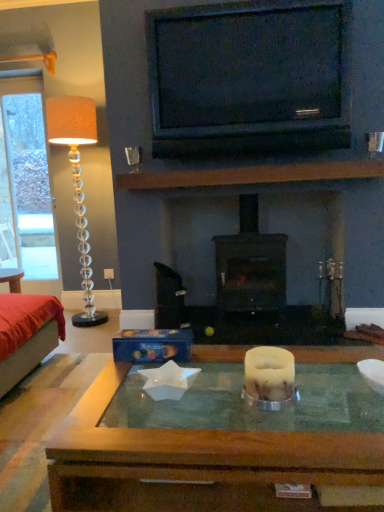
Describe the element at coordinates (27, 334) in the screenshot. The width and height of the screenshot is (384, 512). I see `velvet red bed at left` at that location.

Identify the location of black glossy tv at upper center. [x=249, y=78].

Where is `white plastic power outlet at lower center`? The image size is (384, 512). white plastic power outlet at lower center is located at coordinates (109, 274).

Can you confirm if white wax candle at center is taller than white plastic power outlet at lower center?

Correct, white wax candle at center is much taller as white plastic power outlet at lower center.

Can you confirm if white wax candle at center is wider than white plastic power outlet at lower center?

Yes.

From a real-world perspective, which is physically above, white wax candle at center or white plastic power outlet at lower center?

white wax candle at center, from a real-world perspective.

In the image, is white wax candle at center on the left side or the right side of white plastic power outlet at lower center?

In the image, white wax candle at center appears on the right side of white plastic power outlet at lower center.

Can you confirm if white plastic power outlet at lower center is bigger than white wax candle at center?

Incorrect, white plastic power outlet at lower center is not larger than white wax candle at center.

Can you confirm if white plastic power outlet at lower center is taller than white wax candle at center?

In fact, white plastic power outlet at lower center may be shorter than white wax candle at center.

Is white plastic power outlet at lower center facing towards white wax candle at center?

No, white plastic power outlet at lower center is not aimed at white wax candle at center.

From a real-world perspective, is white plastic power outlet at lower center under white wax candle at center?

Yes, from a real-world perspective, white plastic power outlet at lower center is beneath white wax candle at center.

How far apart are black matte wood burning stove at center and black glossy tv at upper center?

black matte wood burning stove at center and black glossy tv at upper center are 3.38 feet apart.

Is the depth of black matte wood burning stove at center greater than that of black glossy tv at upper center?

Yes, black matte wood burning stove at center is further from the viewer.

From the image's perspective, is black matte wood burning stove at center below black glossy tv at upper center?

Correct, black matte wood burning stove at center appears lower than black glossy tv at upper center in the image.

Is black matte wood burning stove at center far away from black glossy tv at upper center?

Indeed, black matte wood burning stove at center is not near black glossy tv at upper center.

From the image's perspective, who appears lower, white wax candle at center or metallic silver coffee cup at upper left?

white wax candle at center appears lower in the image.

Between white wax candle at center and metallic silver coffee cup at upper left, which one has more height?

Standing taller between the two is metallic silver coffee cup at upper left.

Which is more to the left, white wax candle at center or metallic silver coffee cup at upper left?

Positioned to the left is metallic silver coffee cup at upper left.

Is white wax candle at center beside metallic silver coffee cup at upper left?

No.

Is white wax candle at center at the back of metallic silver coffee cup at upper left?

That's not correct — metallic silver coffee cup at upper left is not looking away from white wax candle at center.

Who is smaller, metallic silver coffee cup at upper left or white wax candle at center?

metallic silver coffee cup at upper left is smaller.

In the image, is metallic silver coffee cup at upper left positioned in front of or behind white wax candle at center?

Visually, metallic silver coffee cup at upper left is located behind white wax candle at center.

From the image's perspective, is metallic silver coffee cup at upper left located above or below white wax candle at center?

Based on their image positions, metallic silver coffee cup at upper left is located above white wax candle at center.

Looking at this image, are velvet red bed at left and translucent glass floor lamp at left located far from each other?

They are positioned close to each other.

Where is `lamp located on the right of velvet red bed at left`? lamp located on the right of velvet red bed at left is located at coordinates (77, 183).

From the image's perspective, is velvet red bed at left on top of translucent glass floor lamp at left?

Incorrect, from the image's perspective, velvet red bed at left is lower than translucent glass floor lamp at left.

Does black matte wood burning stove at center have a lesser height compared to metallic silver coffee cup at upper left?

Incorrect, the height of black matte wood burning stove at center does not fall short of that of metallic silver coffee cup at upper left.

Measure the distance from black matte wood burning stove at center to metallic silver coffee cup at upper left.

black matte wood burning stove at center and metallic silver coffee cup at upper left are 1.09 meters apart.

Does black matte wood burning stove at center touch metallic silver coffee cup at upper left?

No, black matte wood burning stove at center is not making contact with metallic silver coffee cup at upper left.

In terms of width, does black matte wood burning stove at center look wider or thinner when compared to metallic silver coffee cup at upper left?

Clearly, black matte wood burning stove at center has more width compared to metallic silver coffee cup at upper left.

This screenshot has height=512, width=384. There is a white plastic power outlet at lower center. Find the location of `candle above it (from a real-world perspective)`. candle above it (from a real-world perspective) is located at coordinates (269, 373).

Locate an element on the screen. The height and width of the screenshot is (512, 384). candle that appears below the white plastic power outlet at lower center (from the image's perspective) is located at coordinates (269, 373).

From the image, which object appears to be farther from velvet red bed at left, metallic silver coffee cup at upper left or white wax candle at center?

white wax candle at center is positioned further to the anchor velvet red bed at left.

Looking at the image, which one is located further to black glossy tv at upper center, velvet red bed at left or black matte wood burning stove at center?

velvet red bed at left.

Considering their positions, is black matte wood burning stove at center positioned closer to white plastic power outlet at lower center than translucent glass floor lamp at left?

translucent glass floor lamp at left lies closer to white plastic power outlet at lower center than the other object.

When comparing their distances from white wax candle at center, does translucent glass floor lamp at left or metallic silver coffee cup at upper left seem further?

Among the two, translucent glass floor lamp at left is located further to white wax candle at center.

Consider the image. Estimate the real-world distances between objects in this image. Which object is further from white plastic power outlet at lower center, translucent glass floor lamp at left or white wax candle at center?

The object further to white plastic power outlet at lower center is white wax candle at center.

Looking at the image, which one is located closer to translucent glass floor lamp at left, black glossy tv at upper center or white wax candle at center?

Among the two, black glossy tv at upper center is located nearer to translucent glass floor lamp at left.

Looking at the image, which one is located further to black glossy tv at upper center, metallic silver coffee cup at upper left or velvet red bed at left?

velvet red bed at left lies further to black glossy tv at upper center than the other object.

Looking at the image, which one is located closer to translucent glass floor lamp at left, white plastic power outlet at lower center or metallic silver coffee cup at upper left?

The object closer to translucent glass floor lamp at left is white plastic power outlet at lower center.

Where is `candle between black glossy tv at upper center and velvet red bed at left in the vertical direction`? candle between black glossy tv at upper center and velvet red bed at left in the vertical direction is located at coordinates tap(269, 373).

Locate an element on the screen. The width and height of the screenshot is (384, 512). coffee cup between black glossy tv at upper center and white plastic power outlet at lower center in the vertical direction is located at coordinates (134, 157).

Find the location of a particular element. This screenshot has height=512, width=384. wood burning stove between velvet red bed at left and white plastic power outlet at lower center in the front-back direction is located at coordinates (250, 265).

This screenshot has width=384, height=512. I want to click on lamp situated between velvet red bed at left and black matte wood burning stove at center from left to right, so click(x=77, y=183).